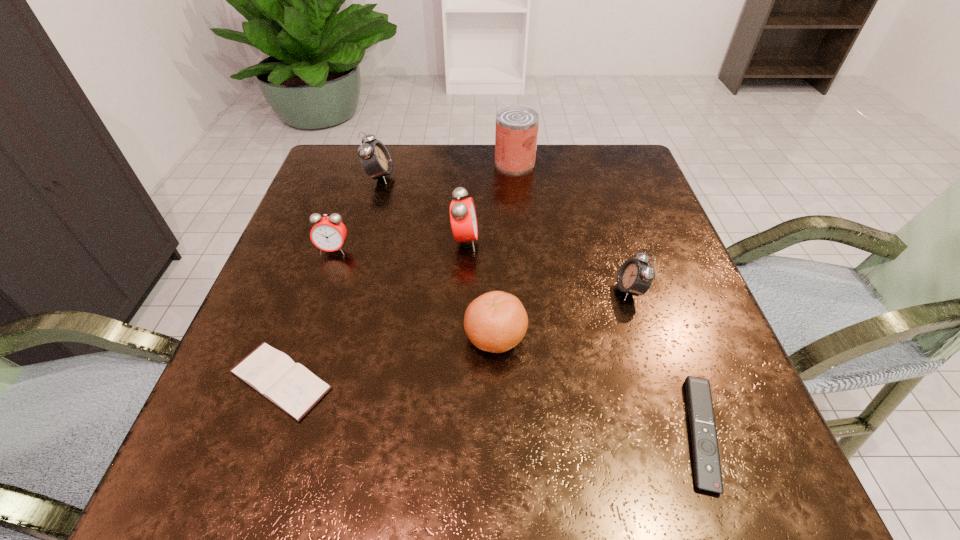
Image resolution: width=960 pixels, height=540 pixels. Find the location of `remote control`. remote control is located at coordinates (707, 468).

Where is `vacant region located on the right of the can`? vacant region located on the right of the can is located at coordinates (610, 163).

Image resolution: width=960 pixels, height=540 pixels. In order to click on vacant space situated 0.170m on the face of the bigger white alarm clock in this screenshot , I will do `click(460, 177)`.

At what (x,y) coordinates should I click in order to perform the action: click on blank space located on the front-facing side of the third alarm clock from left to right. Please return your answer as a coordinate pair (x, y). The image size is (960, 540). Looking at the image, I should click on (515, 241).

This screenshot has width=960, height=540. In order to click on free space located on the face of the nearer white alarm clock in this screenshot , I will do `click(483, 290)`.

Find the location of a particular element. blank space located 0.170m on the face of the nearer white alarm clock is located at coordinates (529, 290).

You are a GUI agent. You are given a task and a screenshot of the screen. Output one action in this format:
    pyautogui.click(x=<x>, y=<y>)
    Task: Click on the blank space located on the face of the nearer white alarm clock
    The image size is (960, 540).
    Given the screenshot: What is the action you would take?
    pyautogui.click(x=575, y=290)

At what (x,y) coordinates should I click in order to perform the action: click on vacant space located on the front-facing side of the left red alarm clock. Please return your answer as a coordinate pair (x, y). Image resolution: width=960 pixels, height=540 pixels. Looking at the image, I should click on (277, 416).

Identify the location of vacant point located on the left of the clementine. This screenshot has width=960, height=540. (279, 337).

Identify the location of free space located 0.070m on the right of the diary. This screenshot has width=960, height=540. (377, 380).